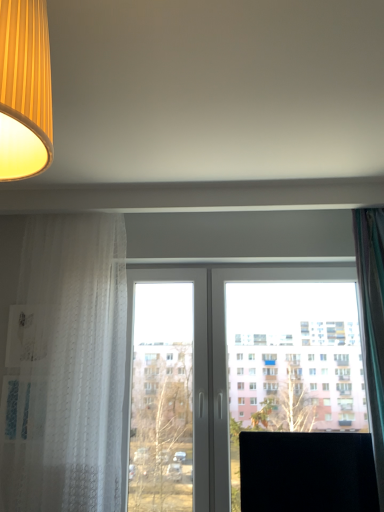
What is the approximate height of green sheer curtain at right, which is the 2th curtain from left to right?

It is 1.36 meters.

What is the approximate height of transparent glass window at center?

1.26 meters.

Describe the element at coordinates (237, 368) in the screenshot. Image resolution: width=384 pixels, height=512 pixels. I see `transparent glass window at center` at that location.

What is the approximate width of white sheer curtain at left, placed as the second curtain when sorted from right to left?

It is 11.27 inches.

What do you see at coordinates (62, 362) in the screenshot?
I see `white sheer curtain at left, placed as the second curtain when sorted from right to left` at bounding box center [62, 362].

Locate an element on the screen. matte yellow fabric lampshade at upper left is located at coordinates (25, 89).

Between green sheer curtain at right, which is the 2th curtain from left to right, and white sheer curtain at left, the 1th curtain viewed from the left, which one has larger size?

Bigger between the two is white sheer curtain at left, the 1th curtain viewed from the left.

Which is more to the left, green sheer curtain at right, the first curtain in the right-to-left sequence, or white sheer curtain at left, the 1th curtain viewed from the left?

From the viewer's perspective, white sheer curtain at left, the 1th curtain viewed from the left, appears more on the left side.

From the picture: Is green sheer curtain at right, which is the 2th curtain from left to right, outside of white sheer curtain at left, the 1th curtain viewed from the left?

Absolutely, green sheer curtain at right, which is the 2th curtain from left to right, is external to white sheer curtain at left, the 1th curtain viewed from the left.

How distant is green sheer curtain at right, which is the 2th curtain from left to right, from white sheer curtain at left, the 1th curtain viewed from the left?

1.42 meters.

Can you confirm if green sheer curtain at right, which is the 2th curtain from left to right, is shorter than black matte computer monitor at lower right?

No.

Is green sheer curtain at right, which is the 2th curtain from left to right, oriented away from black matte computer monitor at lower right?

No, green sheer curtain at right, which is the 2th curtain from left to right, is not facing the opposite direction of black matte computer monitor at lower right.

Is green sheer curtain at right, the first curtain in the right-to-left sequence, positioned behind black matte computer monitor at lower right?

That is False.

In terms of size, does green sheer curtain at right, the first curtain in the right-to-left sequence, appear bigger or smaller than black matte computer monitor at lower right?

green sheer curtain at right, the first curtain in the right-to-left sequence, is bigger than black matte computer monitor at lower right.

From the picture: Can you tell me how much green sheer curtain at right, which is the 2th curtain from left to right, and matte yellow fabric lampshade at upper left differ in facing direction?

green sheer curtain at right, which is the 2th curtain from left to right, and matte yellow fabric lampshade at upper left are facing 0.168 degrees away from each other.

Considering their positions, is green sheer curtain at right, the first curtain in the right-to-left sequence, located in front of or behind matte yellow fabric lampshade at upper left?

green sheer curtain at right, the first curtain in the right-to-left sequence, is behind matte yellow fabric lampshade at upper left.

Considering the sizes of objects green sheer curtain at right, the first curtain in the right-to-left sequence, and matte yellow fabric lampshade at upper left in the image provided, who is shorter, green sheer curtain at right, the first curtain in the right-to-left sequence, or matte yellow fabric lampshade at upper left?

matte yellow fabric lampshade at upper left.

Consider the image. Which of these two, green sheer curtain at right, the first curtain in the right-to-left sequence, or matte yellow fabric lampshade at upper left, is wider?

matte yellow fabric lampshade at upper left is wider.

Is transparent glass window at center inside or outside of matte yellow fabric lampshade at upper left?

transparent glass window at center lies outside matte yellow fabric lampshade at upper left.

Visually, is transparent glass window at center positioned to the left or to the right of matte yellow fabric lampshade at upper left?

transparent glass window at center is positioned on matte yellow fabric lampshade at upper left's right side.

Considering the sizes of objects transparent glass window at center and matte yellow fabric lampshade at upper left in the image provided, who is taller, transparent glass window at center or matte yellow fabric lampshade at upper left?

transparent glass window at center.

From the image's perspective, between transparent glass window at center and matte yellow fabric lampshade at upper left, which one is located above?

From the image's view, matte yellow fabric lampshade at upper left is above.

From the image's perspective, is transparent glass window at center located beneath white sheer curtain at left, placed as the second curtain when sorted from right to left?

Correct, transparent glass window at center appears lower than white sheer curtain at left, placed as the second curtain when sorted from right to left, in the image.

From a real-world perspective, which is physically below, transparent glass window at center or white sheer curtain at left, the 1th curtain viewed from the left?

transparent glass window at center, from a real-world perspective.

Considering the sizes of objects transparent glass window at center and white sheer curtain at left, placed as the second curtain when sorted from right to left, in the image provided, who is bigger, transparent glass window at center or white sheer curtain at left, placed as the second curtain when sorted from right to left,?

Bigger between the two is white sheer curtain at left, placed as the second curtain when sorted from right to left.

Is there a large distance between transparent glass window at center and white sheer curtain at left, the 1th curtain viewed from the left?

transparent glass window at center is actually quite close to white sheer curtain at left, the 1th curtain viewed from the left.

From the image's perspective, does white sheer curtain at left, the 1th curtain viewed from the left, appear higher than matte yellow fabric lampshade at upper left?

Incorrect, from the image's perspective, white sheer curtain at left, the 1th curtain viewed from the left, is lower than matte yellow fabric lampshade at upper left.

Looking at this image, is white sheer curtain at left, the 1th curtain viewed from the left, closer to camera compared to matte yellow fabric lampshade at upper left?

No, white sheer curtain at left, the 1th curtain viewed from the left, is further to the viewer.

Considering the points (38, 369) and (33, 120), which point is in front, point (38, 369) or point (33, 120)?

The point (33, 120) is closer.

From their relative heights in the image, would you say white sheer curtain at left, placed as the second curtain when sorted from right to left, is taller or shorter than matte yellow fabric lampshade at upper left?

Considering their sizes, white sheer curtain at left, placed as the second curtain when sorted from right to left, has more height than matte yellow fabric lampshade at upper left.

Consider the image. Can you confirm if matte yellow fabric lampshade at upper left is wider than transparent glass window at center?

Indeed, matte yellow fabric lampshade at upper left has a greater width compared to transparent glass window at center.

Measure the distance from matte yellow fabric lampshade at upper left to transparent glass window at center.

The distance of matte yellow fabric lampshade at upper left from transparent glass window at center is 1.97 meters.

Is matte yellow fabric lampshade at upper left to the left of transparent glass window at center from the viewer's perspective?

Indeed, matte yellow fabric lampshade at upper left is positioned on the left side of transparent glass window at center.

In terms of height, does matte yellow fabric lampshade at upper left look taller or shorter compared to transparent glass window at center?

Clearly, matte yellow fabric lampshade at upper left is shorter compared to transparent glass window at center.

Where is `curtain that is in front of the white sheer curtain at left, placed as the second curtain when sorted from right to left`? The width and height of the screenshot is (384, 512). curtain that is in front of the white sheer curtain at left, placed as the second curtain when sorted from right to left is located at coordinates (372, 323).

Where is `curtain that is the 2nd object above the black matte computer monitor at lower right (from a real-world perspective)`? This screenshot has width=384, height=512. curtain that is the 2nd object above the black matte computer monitor at lower right (from a real-world perspective) is located at coordinates (372, 323).

When comparing their distances from white sheer curtain at left, placed as the second curtain when sorted from right to left, does transparent glass window at center or green sheer curtain at right, which is the 2th curtain from left to right, seem closer?

transparent glass window at center is closer to white sheer curtain at left, placed as the second curtain when sorted from right to left.

When comparing their distances from green sheer curtain at right, the first curtain in the right-to-left sequence, does matte yellow fabric lampshade at upper left or black matte computer monitor at lower right seem further?

matte yellow fabric lampshade at upper left is positioned further to the anchor green sheer curtain at right, the first curtain in the right-to-left sequence.

Based on their spatial positions, is green sheer curtain at right, which is the 2th curtain from left to right, or transparent glass window at center further from white sheer curtain at left, the 1th curtain viewed from the left?

Among the two, green sheer curtain at right, which is the 2th curtain from left to right, is located further to white sheer curtain at left, the 1th curtain viewed from the left.

Based on their spatial positions, is matte yellow fabric lampshade at upper left or black matte computer monitor at lower right further from transparent glass window at center?

matte yellow fabric lampshade at upper left is further to transparent glass window at center.

Based on their spatial positions, is transparent glass window at center or white sheer curtain at left, placed as the second curtain when sorted from right to left, closer to matte yellow fabric lampshade at upper left?

Among the two, white sheer curtain at left, placed as the second curtain when sorted from right to left, is located nearer to matte yellow fabric lampshade at upper left.

When comparing their distances from black matte computer monitor at lower right, does matte yellow fabric lampshade at upper left or transparent glass window at center seem closer?

transparent glass window at center.

From the image, which object appears to be nearer to matte yellow fabric lampshade at upper left, white sheer curtain at left, placed as the second curtain when sorted from right to left, or black matte computer monitor at lower right?

Based on the image, white sheer curtain at left, placed as the second curtain when sorted from right to left, appears to be nearer to matte yellow fabric lampshade at upper left.

Looking at the image, which one is located closer to transparent glass window at center, white sheer curtain at left, placed as the second curtain when sorted from right to left, or green sheer curtain at right, the first curtain in the right-to-left sequence?

green sheer curtain at right, the first curtain in the right-to-left sequence, is closer to transparent glass window at center.

Identify the location of computer monitor between matte yellow fabric lampshade at upper left and transparent glass window at center in the front-back direction. The width and height of the screenshot is (384, 512). (307, 472).

Where is `computer monitor located between white sheer curtain at left, placed as the second curtain when sorted from right to left, and green sheer curtain at right, which is the 2th curtain from left to right, in the left-right direction`? computer monitor located between white sheer curtain at left, placed as the second curtain when sorted from right to left, and green sheer curtain at right, which is the 2th curtain from left to right, in the left-right direction is located at coordinates (307, 472).

Locate an element on the screen. window located between white sheer curtain at left, the 1th curtain viewed from the left, and black matte computer monitor at lower right in the left-right direction is located at coordinates (237, 368).

Find the location of a particular element. lamp between white sheer curtain at left, placed as the second curtain when sorted from right to left, and green sheer curtain at right, which is the 2th curtain from left to right, from left to right is located at coordinates (25, 89).